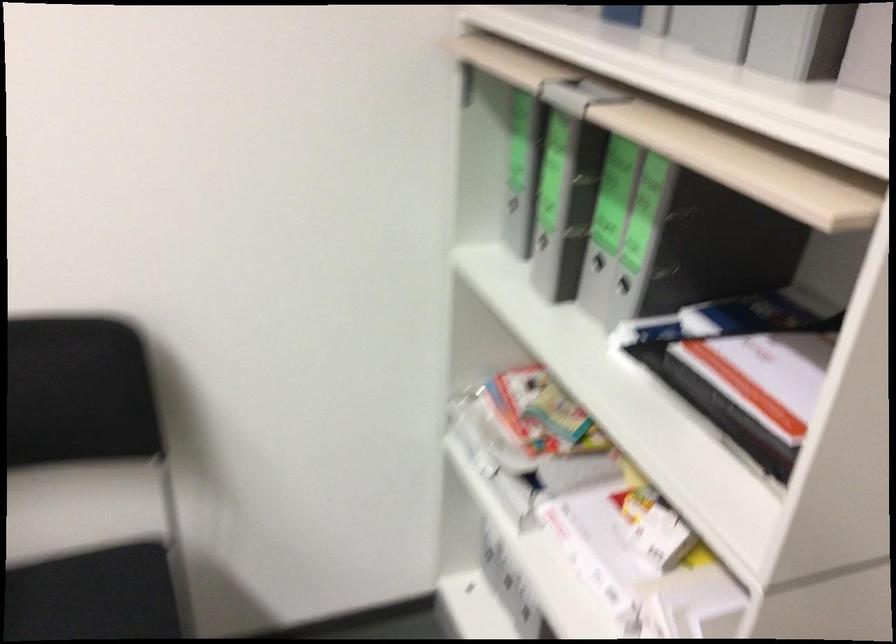
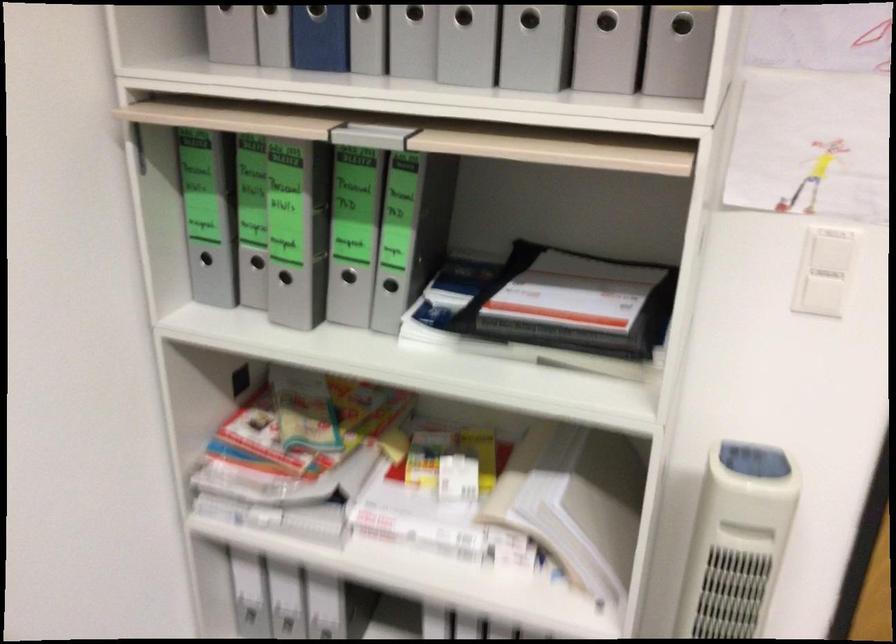
In the second image, find the point that corresponds to point (641, 287) in the first image.

(390, 285)